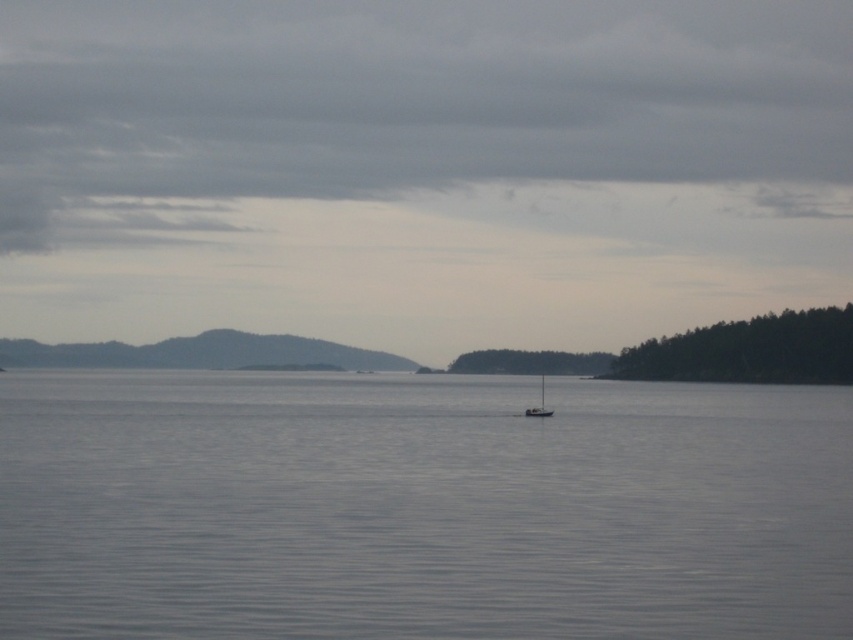
You are standing on the shore and see the clear water at center and the white matte sailboat at center. Which object is closer to the horizon?

The white matte sailboat at center is closer to the horizon because it is above the clear water at center, which is below it.

You are standing at the point marked as point (x=421, y=508) in the image. What is located at this exact point?

The point (x=421, y=508) is occupied by clear water at center.

You are a photographer planning to capture the white matte sailboat at center in the image. Considering the clear water at center, which object would occupy more of the frame if you focus on the sailboat?

The clear water at center has a larger size compared to the white matte sailboat at center, so focusing on the sailboat would still allow the water to take up more of the frame due to its greater size.